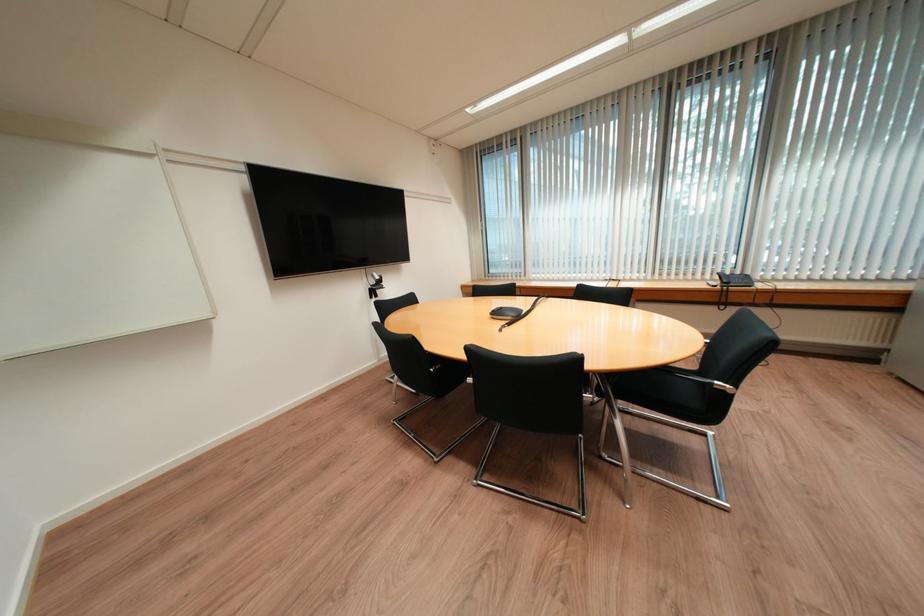
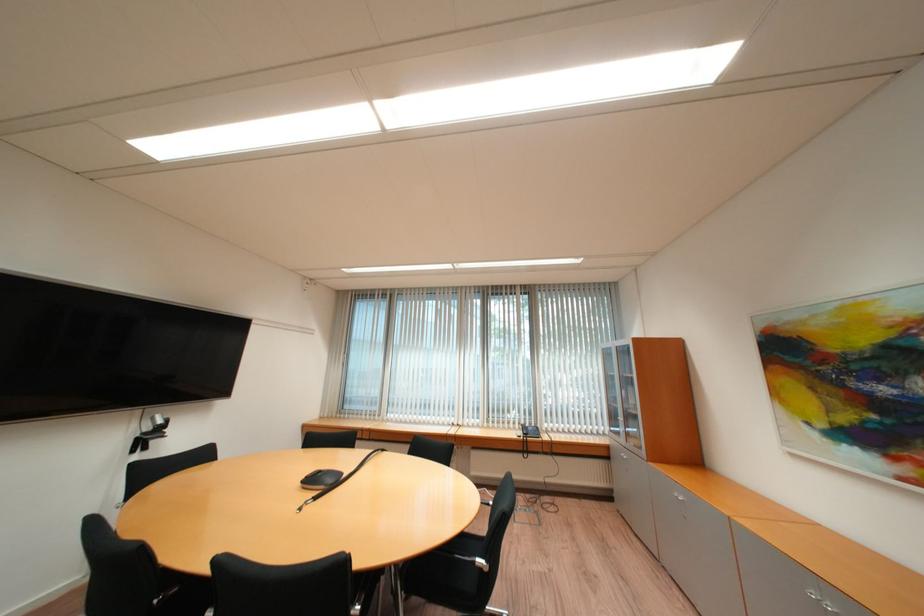
Find the pixel in the second image that matches [725,384] in the first image.

(487, 561)